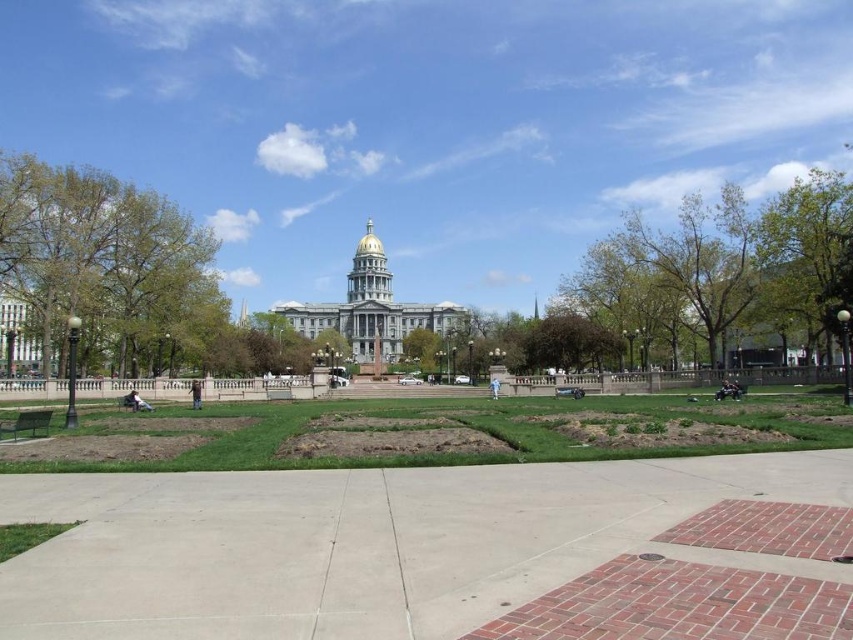
Question: Is the position of concrete at center more distant than that of green leafy tree at left?

Choices:
 (A) no
 (B) yes

Answer: (A)

Question: Which object is positioned farthest from the green leafy tree at left?

Choices:
 (A) green leafy tree at upper right
 (B) concrete at center

Answer: (A)

Question: Which is farther from the green leafy tree at upper right?

Choices:
 (A) green leafy tree at left
 (B) concrete at center

Answer: (A)

Question: Is concrete at center wider than green leafy tree at left?

Choices:
 (A) yes
 (B) no

Answer: (A)

Question: Does concrete at center have a larger size compared to green leafy tree at left?

Choices:
 (A) yes
 (B) no

Answer: (B)

Question: Which object is farther from the camera taking this photo?

Choices:
 (A) green leafy tree at upper right
 (B) concrete at center
 (C) green leafy tree at left

Answer: (A)